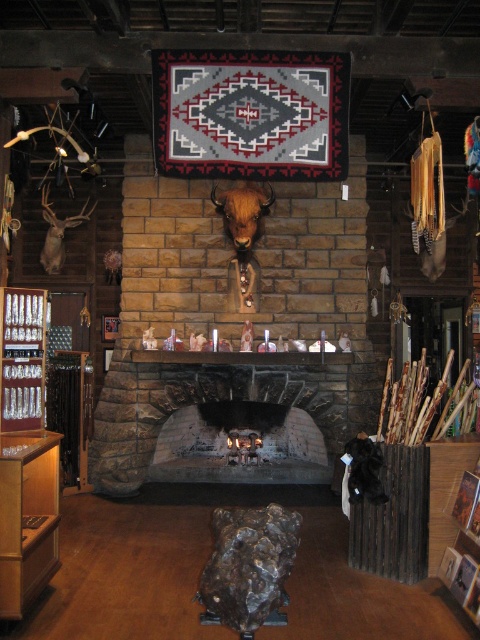
You are a delivery person who needs to place a large package on the mantel above the black stone fireplace at center and the matte brown deer head at left. Which object should you place the package on to ensure it fits properly?

The black stone fireplace at center is bigger than the matte brown deer head at left, so you should place the package on the mantel above the black stone fireplace at center to ensure it fits properly.

You are standing in the rustic store and want to place a new decorative item on the mantel of the black stone fireplace at center. Based on the coordinates provided, where exactly should you aim to place the item?

The black stone fireplace at center is located at coordinates point (x=248, y=417), so you should aim for that position to place the decorative item on its mantel.